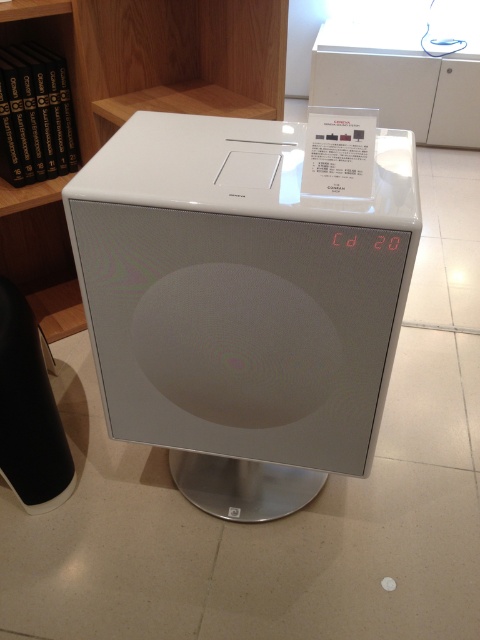
Which is more to the left, white glossy air purifier at center or white matte bookshelf at upper center?

From the viewer's perspective, white matte bookshelf at upper center appears more on the left side.

At what (x,y) coordinates should I click in order to perform the action: click on white glossy air purifier at center. Please return your answer as a coordinate pair (x, y). Looking at the image, I should click on (242, 301).

Does point (239, 192) lie in front of point (105, 13)?

Yes, point (239, 192) is in front of point (105, 13).

Locate an element on the screen. white glossy air purifier at center is located at coordinates (242, 301).